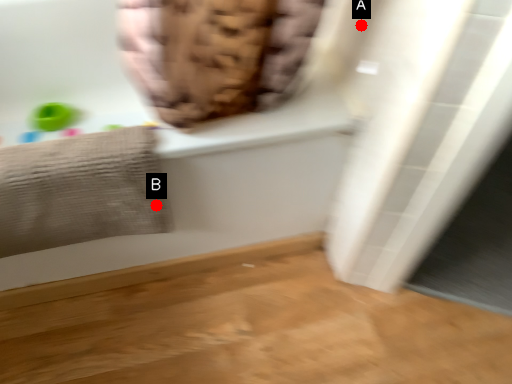
Question: Two points are circled on the image, labeled by A and B beside each circle. Which point appears farthest from the camera in this image?

Choices:
 (A) A is further
 (B) B is further

Answer: (B)